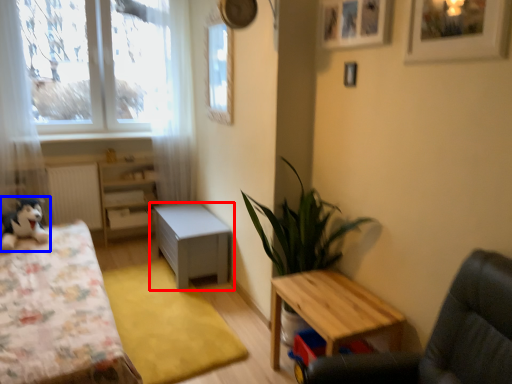
Question: Among these objects, which one is farthest to the camera, table (highlighted by a red box) or toy (highlighted by a blue box)?

Choices:
 (A) table
 (B) toy

Answer: (A)